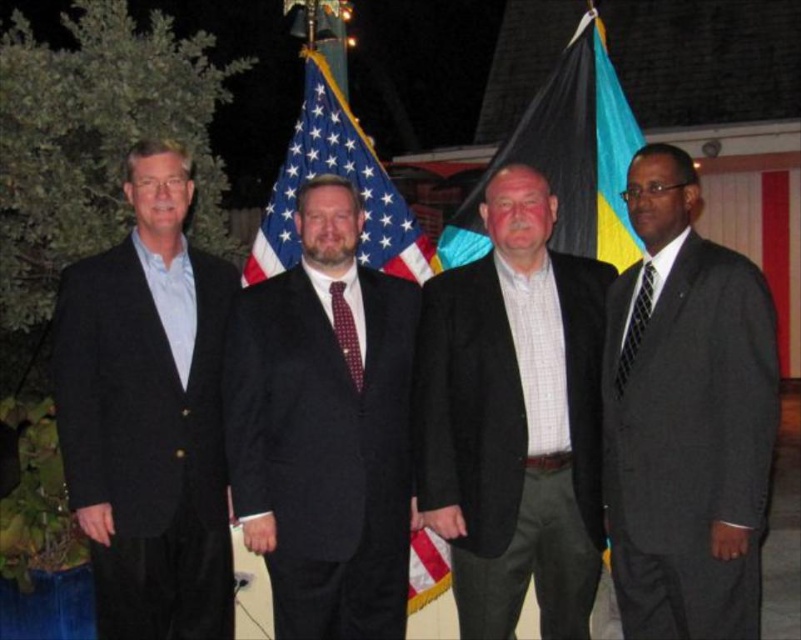
Question: Does dark suit at center have a smaller size compared to maroon textured tie at center?

Choices:
 (A) yes
 (B) no

Answer: (B)

Question: Can you confirm if black fabric flag at center is positioned below american flag at center?

Choices:
 (A) yes
 (B) no

Answer: (A)

Question: Which is farther from the american flag at center?

Choices:
 (A) matte gray suit at right
 (B) matte black suit at left
 (C) checkered fabric shirt at center
 (D) maroon textured tie at center

Answer: (A)

Question: Does matte gray suit at right have a greater width compared to dark suit at center?

Choices:
 (A) no
 (B) yes

Answer: (A)

Question: Estimate the real-world distances between objects in this image. Which object is closer to the black fabric flag at center?

Choices:
 (A) checkered fabric shirt at center
 (B) matte gray suit at right
 (C) dark suit at center
 (D) black textured tie at right

Answer: (D)

Question: Which of the following is the farthest from the observer?

Choices:
 (A) (582, 145)
 (B) (409, 230)

Answer: (A)